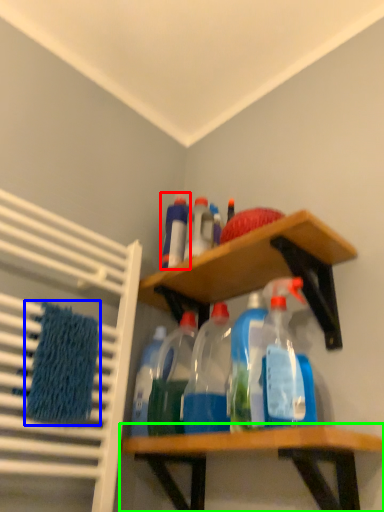
Question: Estimate the real-world distances between objects in this image. Which object is farther from bottle (highlighted by a red box), bath towel (highlighted by a blue box) or shelf (highlighted by a green box)?

Choices:
 (A) bath towel
 (B) shelf

Answer: (B)